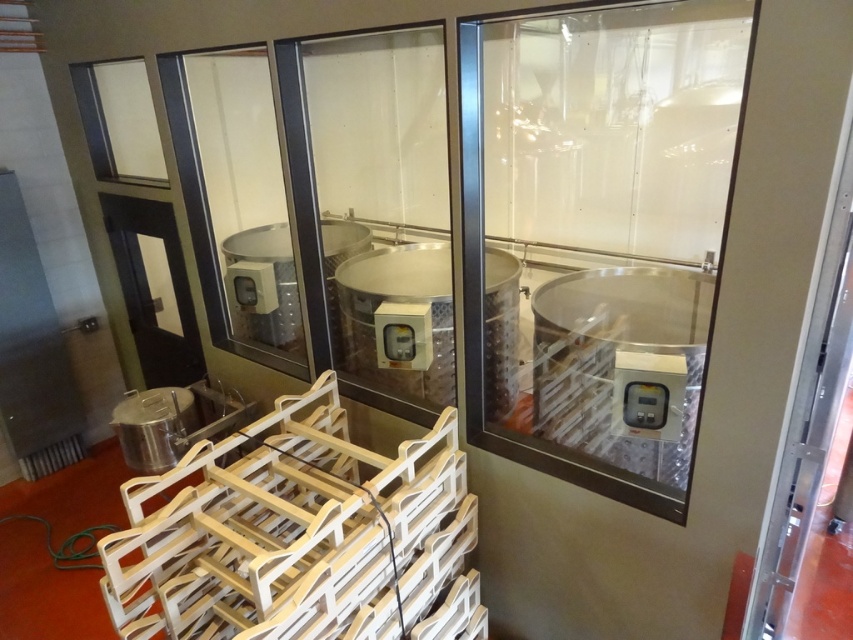
Who is higher up, transparent plastic door at center or light wood crate at center?

transparent plastic door at center is higher up.

Locate an element on the screen. The width and height of the screenshot is (853, 640). transparent plastic door at center is located at coordinates (602, 228).

In order to click on transparent plastic door at center in this screenshot , I will do `click(602, 228)`.

Is transparent plastic door at center below transparent glass door at center?

Indeed, transparent plastic door at center is positioned under transparent glass door at center.

Is transparent plastic door at center to the left of transparent glass door at center from the viewer's perspective?

In fact, transparent plastic door at center is to the right of transparent glass door at center.

Between point (584, 461) and point (381, 189), which one is positioned behind?

The point (381, 189) is more distant.

Where is `transparent plastic door at center`? This screenshot has width=853, height=640. transparent plastic door at center is located at coordinates (602, 228).

Does light wood crate at center have a lesser width compared to transparent glass door at center?

Incorrect, light wood crate at center's width is not less than transparent glass door at center's.

Measure the distance between light wood crate at center and transparent glass door at center.

They are 23.68 inches apart.

Between point (190, 538) and point (428, 189), which one is positioned in front?

Point (190, 538)

Find the location of `light wood crate at center`. light wood crate at center is located at coordinates (300, 536).